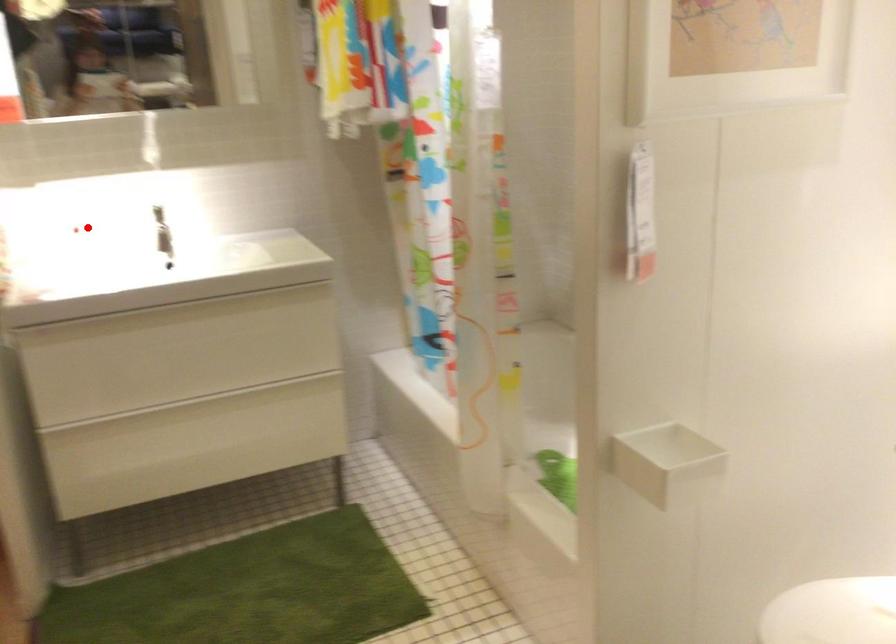
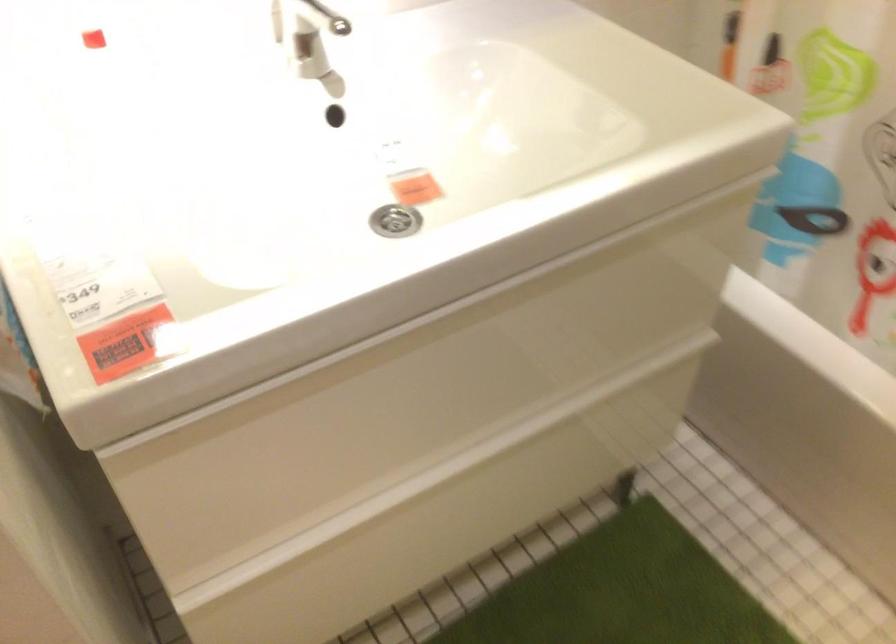
Question: I am providing you with two images of the same scene from different viewpoints. In image1, a red point is highlighted. Considering the same 3D point in image2, which of the following is correct?

Choices:
 (A) It is closer
 (B) It is farther

Answer: (A)